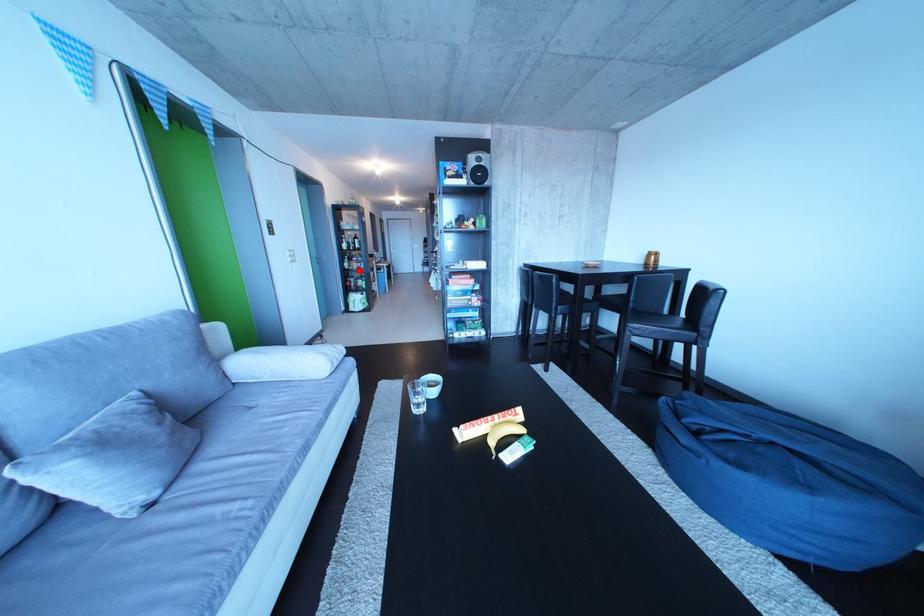
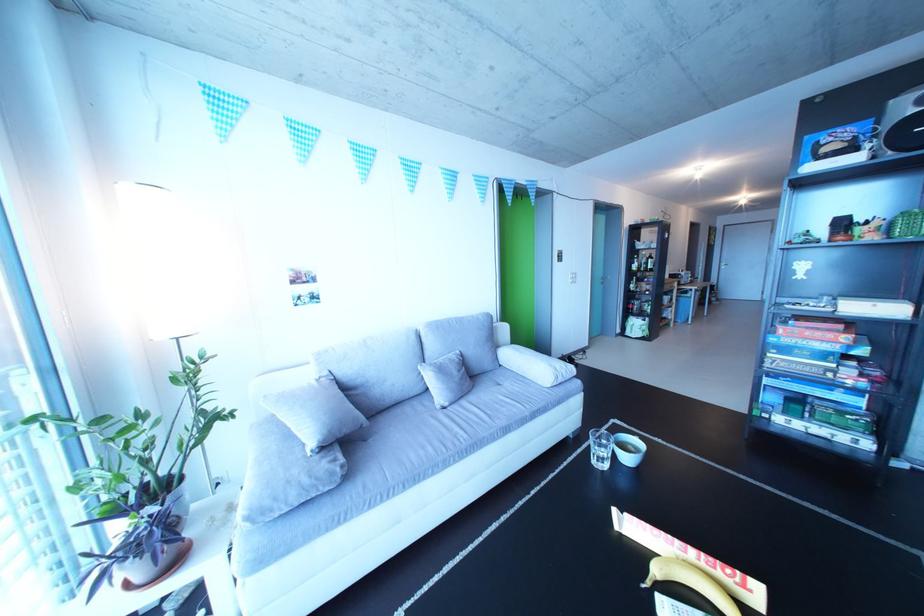
Locate, in the second image, the point that corresponds to the highlighted location in the first image.

(646, 292)